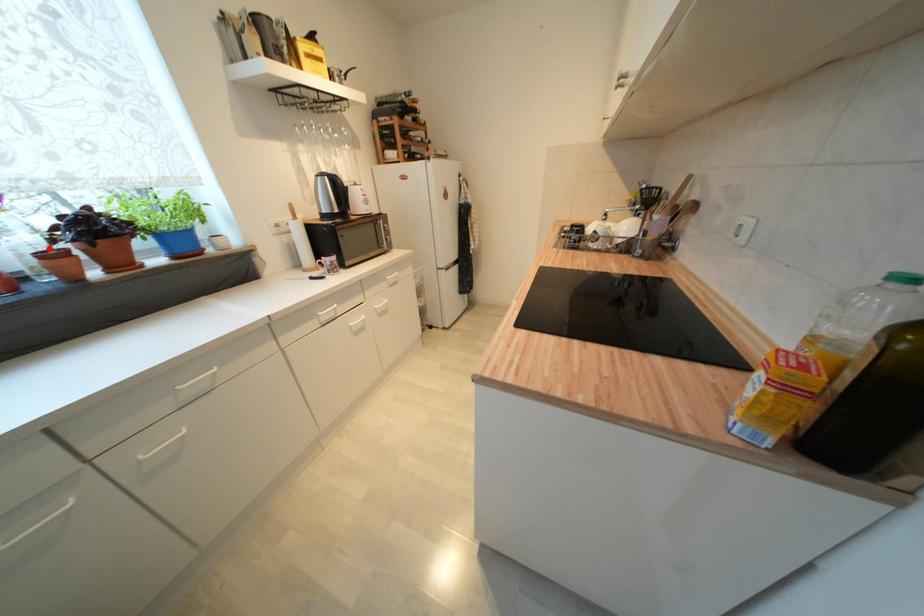
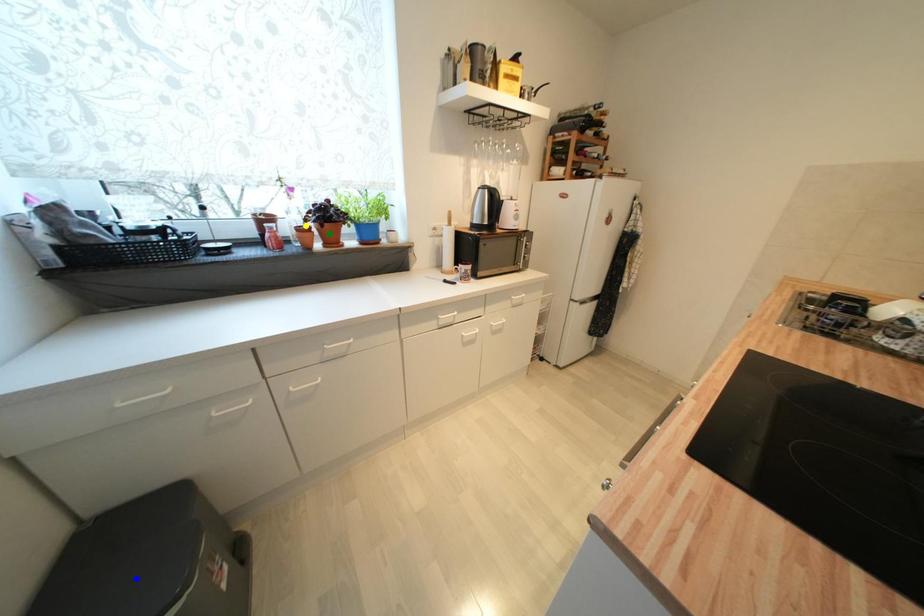
Question: I am providing you with two images of the same scene from different viewpoints. A red point is marked on the first image. You are given multiple points on the second image. In image 2, which mark is for the same physical point as the one in image 1?

Choices:
 (A) blue point
 (B) yellow point
 (C) green point

Answer: (B)